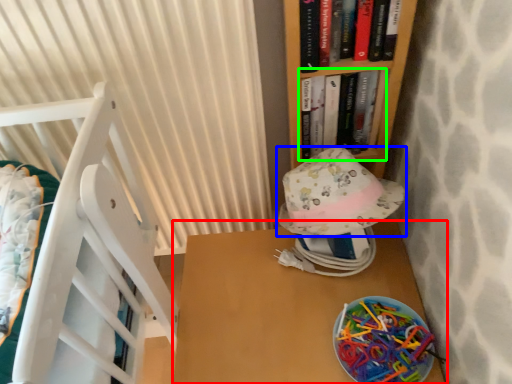
Question: Which is nearer to the table (highlighted by a red box)? hat (highlighted by a blue box) or book (highlighted by a green box).

Choices:
 (A) hat
 (B) book

Answer: (A)